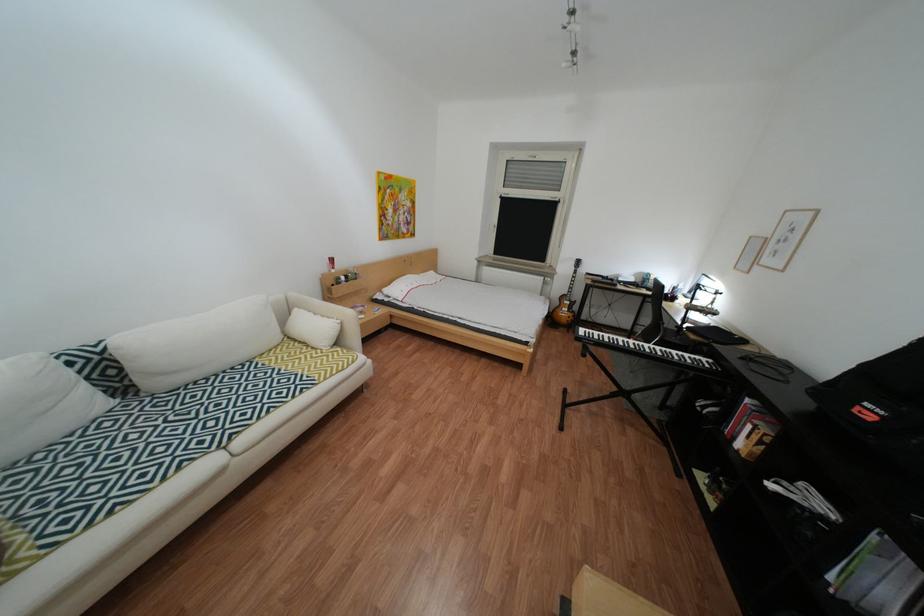
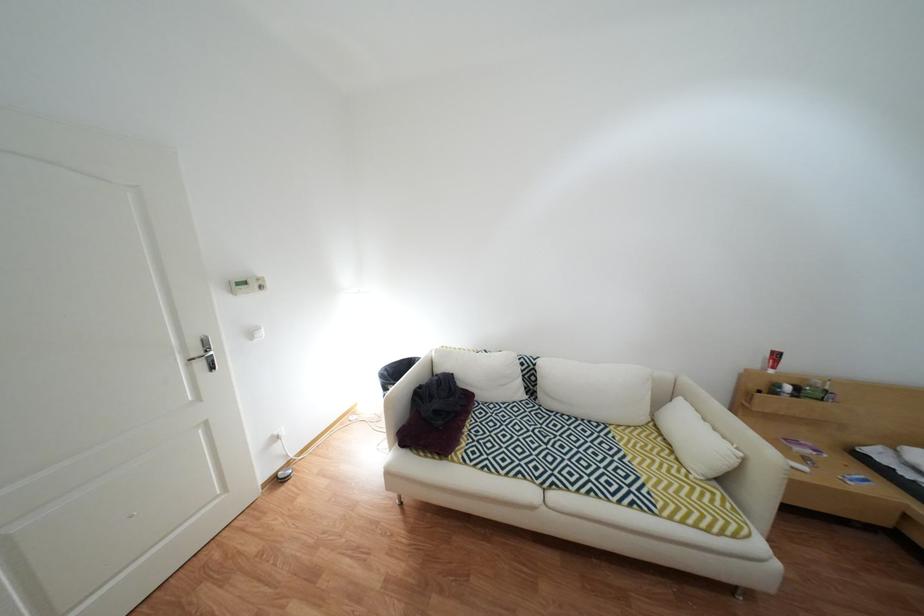
Question: The camera is either moving clockwise (left) or counter-clockwise (right) around the object. The first image is from the beginning of the video and the second image is from the end. Is the camera moving left or right when shooting the video?

Choices:
 (A) Left
 (B) Right

Answer: (B)